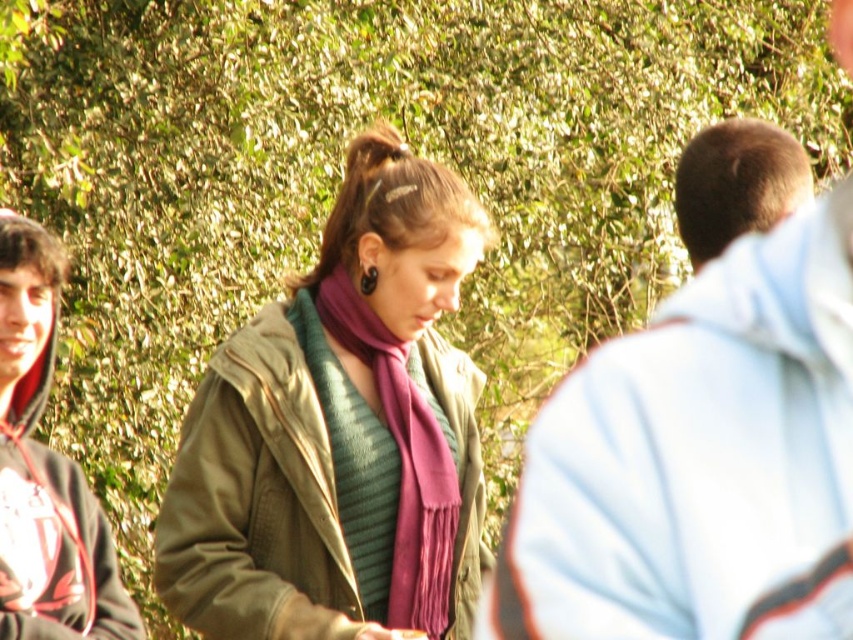
Is light blue hoodie at right to the right of brown hair at right from the viewer's perspective?

No, light blue hoodie at right is not to the right of brown hair at right.

Can you confirm if light blue hoodie at right is wider than brown hair at right?

Yes, light blue hoodie at right is wider than brown hair at right.

The width and height of the screenshot is (853, 640). Identify the location of light blue hoodie at right. (700, 460).

Measure the distance between matte green jacket at center and camera.

matte green jacket at center is 9.80 meters away from camera.

Does matte green jacket at center have a lesser height compared to purple silky scarf at center?

In fact, matte green jacket at center may be taller than purple silky scarf at center.

Which is in front, point (245, 412) or point (398, 552)?

Positioned in front is point (245, 412).

The image size is (853, 640). In order to click on matte green jacket at center in this screenshot , I will do `click(340, 433)`.

Between light blue hoodie at right and dark gray hoodie at left, which one appears on the left side from the viewer's perspective?

Positioned to the left is dark gray hoodie at left.

Which is in front, point (830, 518) or point (16, 579)?

Point (830, 518) is in front.

Find the location of a particular element. This screenshot has width=853, height=640. light blue hoodie at right is located at coordinates (700, 460).

Locate an element on the screen. light blue hoodie at right is located at coordinates (700, 460).